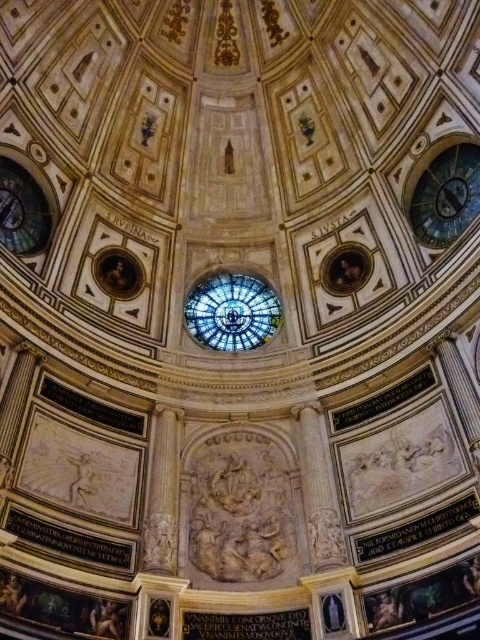
Question: Can you confirm if blue glass clock at upper right is positioned to the right of white marble column at center?

Choices:
 (A) yes
 (B) no

Answer: (A)

Question: Which point is closer to the camera?

Choices:
 (A) (173, 532)
 (B) (458, 218)
 (C) (271, 332)

Answer: (A)

Question: Which point appears closest to the camera in this image?

Choices:
 (A) (421, 225)
 (B) (165, 452)
 (C) (267, 305)

Answer: (B)

Question: Can you confirm if stained glass dome at center is positioned below blue glass clock at upper right?

Choices:
 (A) yes
 (B) no

Answer: (A)

Question: Which object is the closest to the white marble column at center?

Choices:
 (A) stained glass dome at center
 (B) blue glass clock at upper right

Answer: (A)

Question: Does stained glass dome at center appear over blue glass clock at upper right?

Choices:
 (A) yes
 (B) no

Answer: (B)